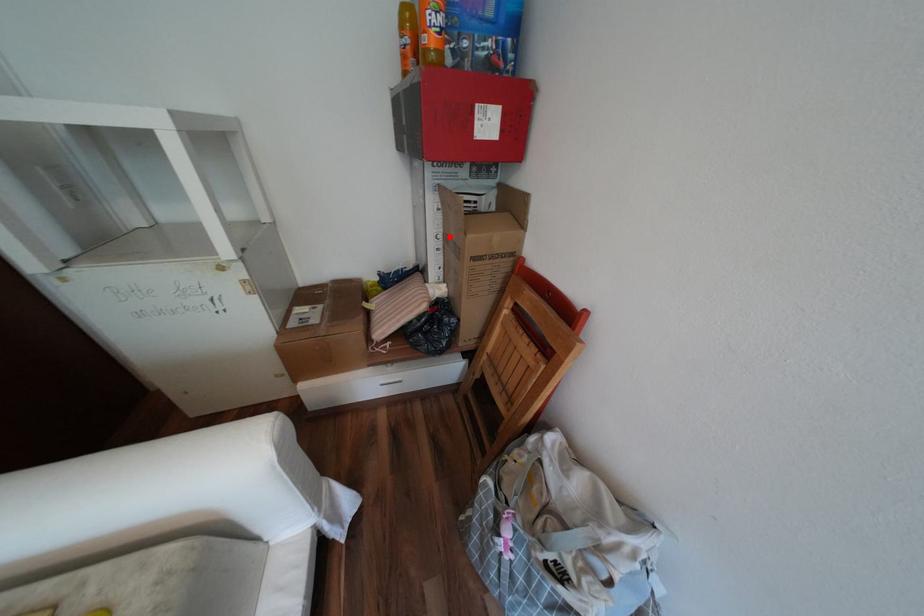
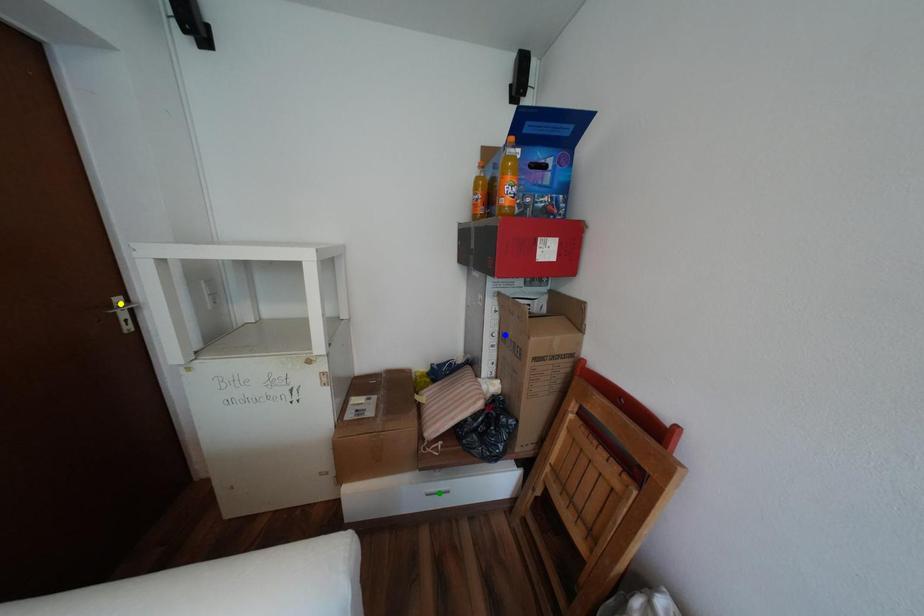
Question: I am providing you with two images of the same scene from different viewpoints. A red point is marked on the first image. You are given multiple points on the second image. Which spot in image 2 lines up with the point in image 1?

Choices:
 (A) yellow point
 (B) green point
 (C) blue point

Answer: (C)